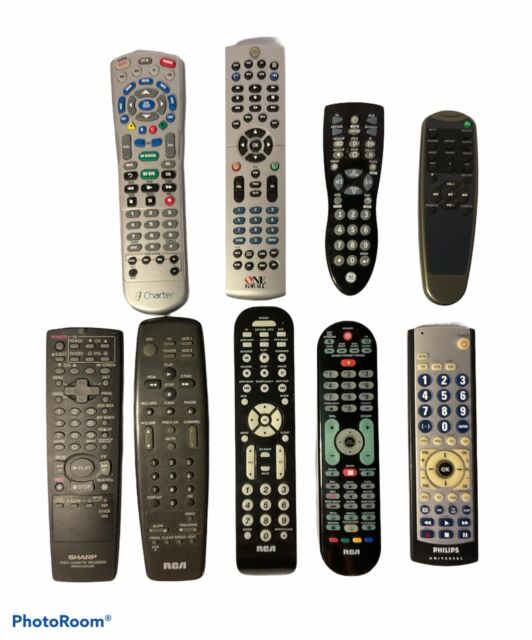
Where is `remote`? This screenshot has height=640, width=532. remote is located at coordinates (89, 404), (163, 412), (287, 516), (346, 481), (161, 192), (238, 224), (328, 220), (442, 204).